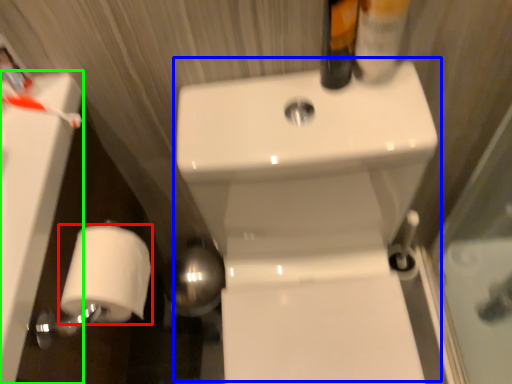
Question: Which is nearer to the toilet paper (highlighted by a red box)? sink (highlighted by a blue box) or bath (highlighted by a green box).

Choices:
 (A) sink
 (B) bath

Answer: (B)